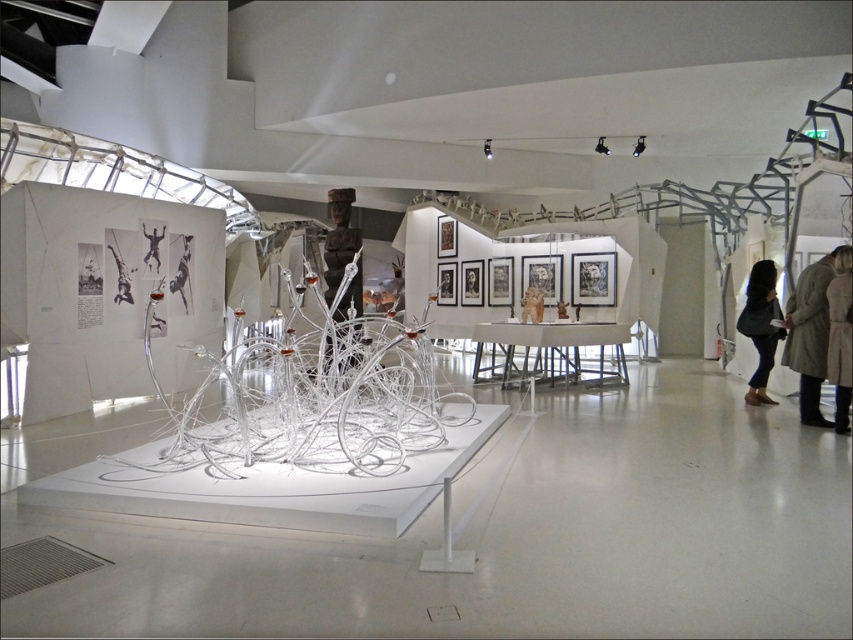
You are an art curator standing at the entrance of the exhibition hall. You need to move the light beige coat at right to a new location so that it is exactly 5 meters away from the metallic figure at center. Is this possible within the current layout described?

The light beige coat at right is currently 7.19 meters from the metallic figure at center. Since 7.19 meters is greater than 5 meters, you can move it closer to achieve the desired distance of 5 meters within the space.

You are standing in the art exhibition space and want to place a light beige coat on the right side of the wire sculpture. Is the location at point (x=811, y=332) suitable for placing the coat?

The location at point (x=811, y=332) is where the light beige coat at right is placed, so it is suitable for placing the coat there.